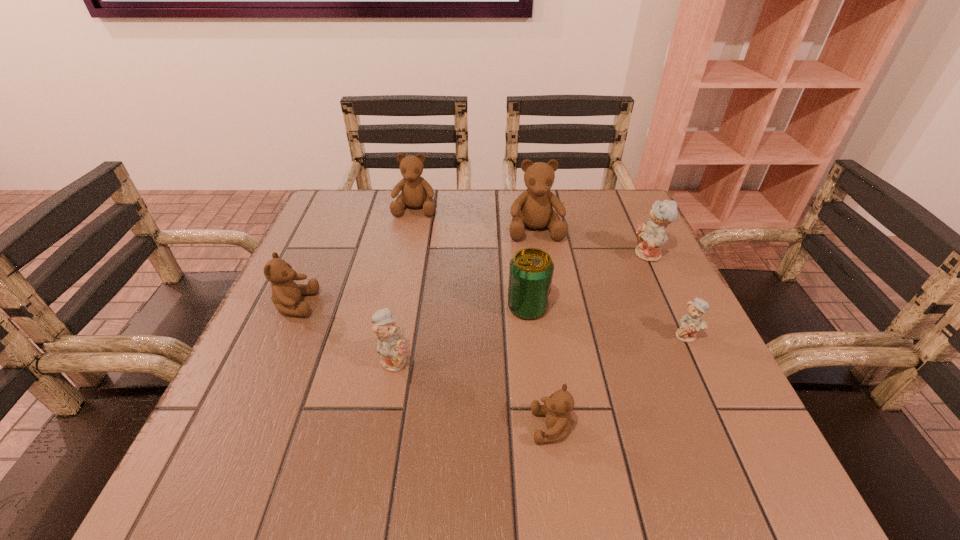
Where is `free spot located on the front-facing side of the third farthest brown teddy bear`? The image size is (960, 540). free spot located on the front-facing side of the third farthest brown teddy bear is located at coordinates (493, 305).

Image resolution: width=960 pixels, height=540 pixels. In order to click on vacant region located on the front-facing side of the smallest blue teddy bear in this screenshot , I will do `click(716, 398)`.

The width and height of the screenshot is (960, 540). I want to click on blank space located 0.090m on the front-facing side of the nearest brown teddy bear, so click(x=475, y=427).

The image size is (960, 540). Find the location of `free region located 0.160m on the front-facing side of the nearest brown teddy bear`. free region located 0.160m on the front-facing side of the nearest brown teddy bear is located at coordinates (432, 427).

Locate an element on the screen. The width and height of the screenshot is (960, 540). free space located on the front-facing side of the nearest brown teddy bear is located at coordinates (482, 427).

You are a GUI agent. You are given a task and a screenshot of the screen. Output one action in this format:
    pyautogui.click(x=<x>, y=<y>)
    Task: Click on the object that is at the near edge
    The height and width of the screenshot is (540, 960).
    Given the screenshot: What is the action you would take?
    pyautogui.click(x=557, y=407)

Image resolution: width=960 pixels, height=540 pixels. Identify the location of object present at the left edge. (286, 294).

Locate an element on the screen. vacant space at the far edge of the desktop is located at coordinates (489, 218).

The height and width of the screenshot is (540, 960). In the image, there is a desktop. What are the coordinates of `vacant space at the near edge` in the screenshot? It's located at (345, 495).

At what (x,y) coordinates should I click in order to perform the action: click on free space at the left edge. Please return your answer as a coordinate pair (x, y). This screenshot has height=540, width=960. Looking at the image, I should click on (287, 430).